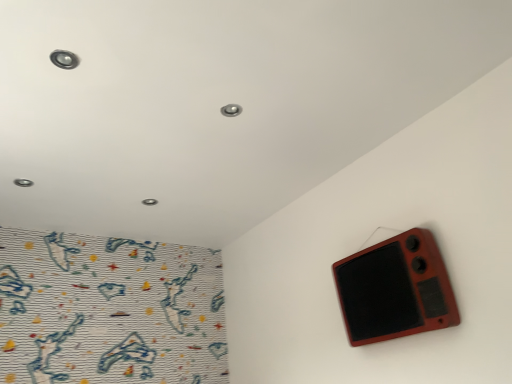
Question: Should I look upward or downward to see matte red speaker at upper right?

Choices:
 (A) up
 (B) down

Answer: (B)